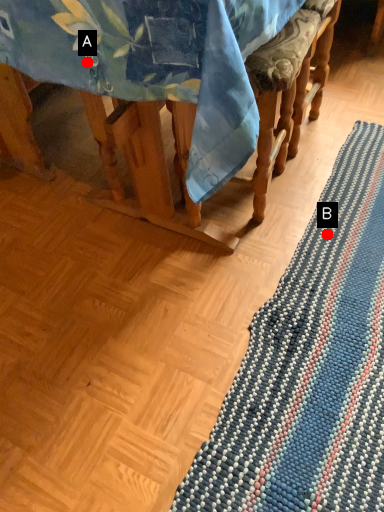
Question: Two points are circled on the image, labeled by A and B beside each circle. Which point is farther to the camera?

Choices:
 (A) A is further
 (B) B is further

Answer: (B)